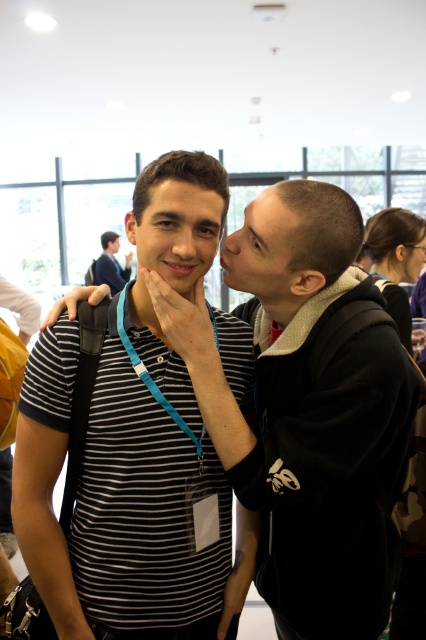
You are organizing a charity clothing drive and need to categorize these two items based on their sizes. The striped cotton shirt at center and the matte black shirt at upper left. Which one should be placed in the small size bin?

The striped cotton shirt at center has a smaller size compared to matte black shirt at upper left, so it should be placed in the small size bin.

Consider the image. You are at a conference and need to identify the attendee with the longest lanyard. Which attendee has it? The blue fabric lanyard at center or the matte black shirt at upper left?

The blue fabric lanyard at center is shorter than the matte black shirt at upper left, so the attendee with the matte black shirt at upper left has the longer lanyard.

You are taking a photo of two people at an event. You notice two points marked in the image. The first point is at coordinates point (126, 342) and the second point is at point (117, 268). Which of these two points is closer to the camera?

Point (126, 342) is closer to the camera than point (117, 268).